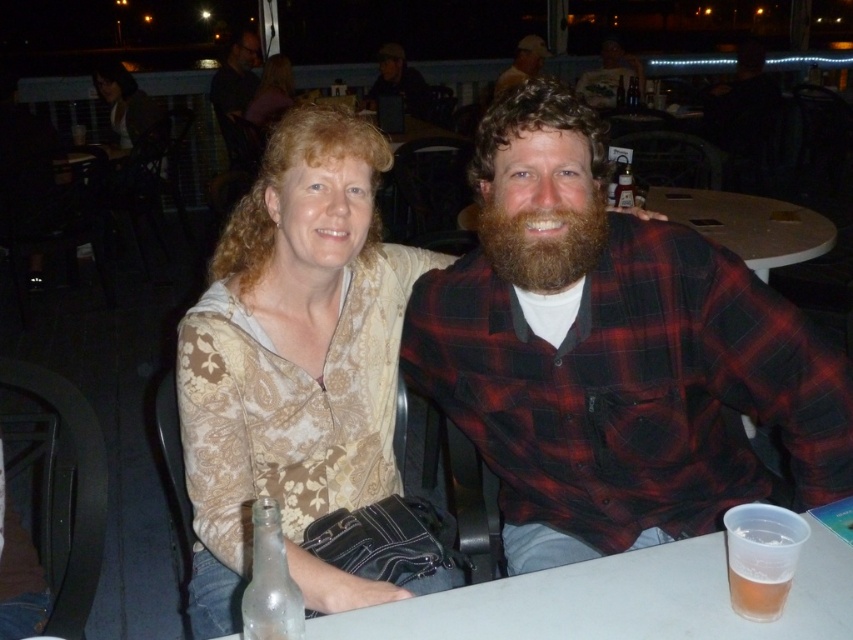
Who is lower down, bearded man at center or matte purple shirt at upper center?

matte purple shirt at upper center is lower down.

Between point (604, 96) and point (270, 67), which one is positioned in front?

Point (270, 67)

Locate an element on the screen. Image resolution: width=853 pixels, height=640 pixels. bearded man at center is located at coordinates (608, 74).

Between point (93, 83) and point (527, 61), which one is positioned in front?

Point (93, 83) is more forward.

Who is higher up, matte beige blouse at upper left or matte white cap at upper center?

matte white cap at upper center

What do you see at coordinates (129, 113) in the screenshot? The width and height of the screenshot is (853, 640). I see `matte beige blouse at upper left` at bounding box center [129, 113].

At what (x,y) coordinates should I click in order to perform the action: click on matte beige blouse at upper left. Please return your answer as a coordinate pair (x, y). Looking at the image, I should click on (129, 113).

This screenshot has height=640, width=853. What do you see at coordinates (759, 592) in the screenshot?
I see `translucent plastic cup at lower right` at bounding box center [759, 592].

Image resolution: width=853 pixels, height=640 pixels. Identify the location of translucent plastic cup at lower right. (759, 592).